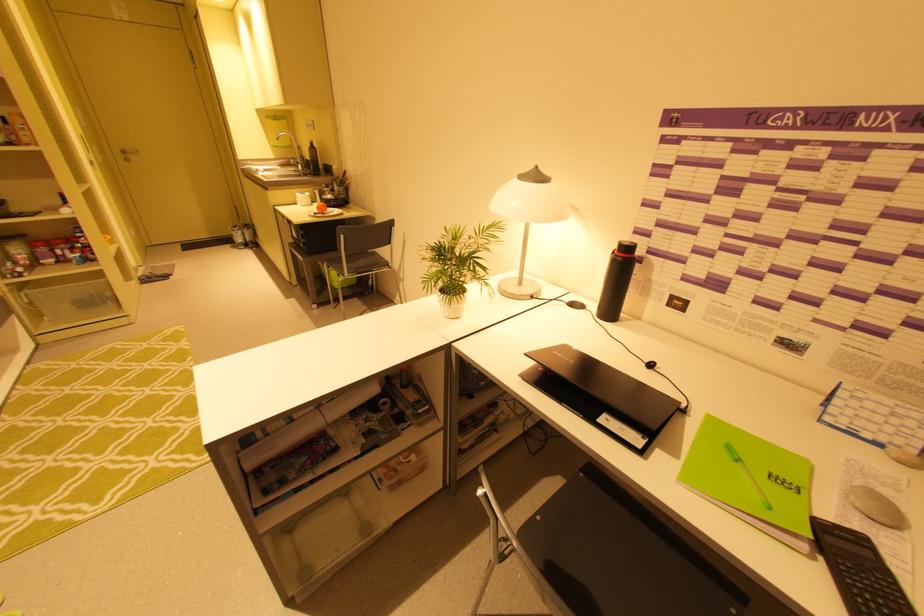
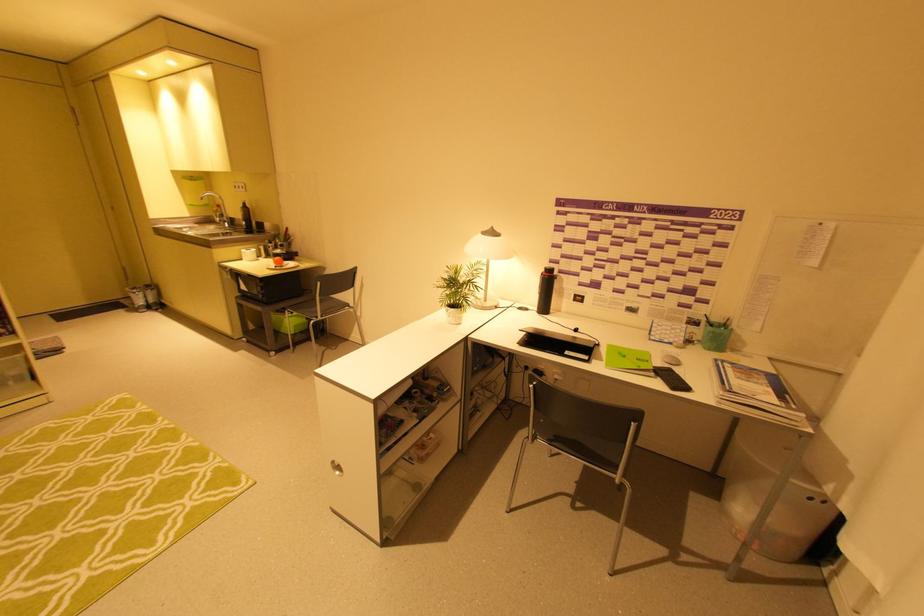
Find the pixel in the second image that matches the point at 241,233 in the first image.

(142, 296)